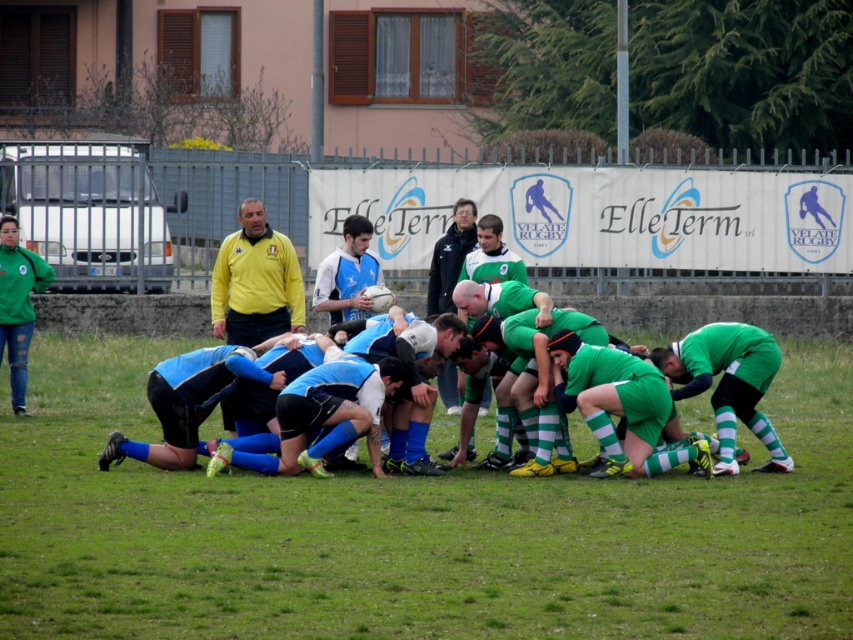
Question: Which object is positioned farthest from the yellow jersey at center?

Choices:
 (A) blue fabric rugby players at center
 (B) dark blue jersey at center
 (C) blue jersey rugby team at center
 (D) jeans at left

Answer: (A)

Question: Can you confirm if blue jersey rugby team at center is bigger than jeans at left?

Choices:
 (A) no
 (B) yes

Answer: (B)

Question: Is jeans at left closer to camera compared to dark blue jersey at center?

Choices:
 (A) no
 (B) yes

Answer: (B)

Question: Does blue jersey rugby team at center have a larger size compared to jeans at left?

Choices:
 (A) yes
 (B) no

Answer: (A)

Question: Which point appears farthest from the camera in this image?

Choices:
 (A) (405, 346)
 (B) (468, 205)

Answer: (B)

Question: Considering the real-world distances, which object is closest to the blue jersey rugby team at center?

Choices:
 (A) dark blue jersey at center
 (B) blue fabric rugby players at center
 (C) jeans at left
 (D) yellow jersey at center

Answer: (B)